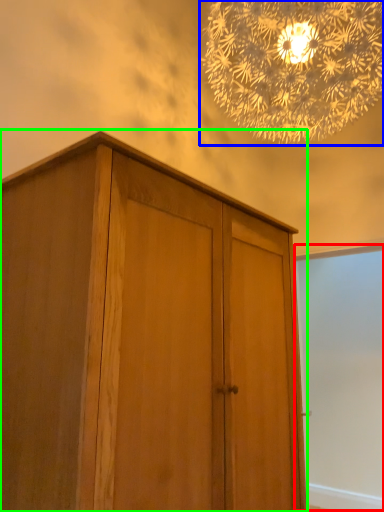
Question: Which object is the closest to the screen door (highlighted by a red box)? Choose among these: lamp (highlighted by a blue box) or cupboard (highlighted by a green box).

Choices:
 (A) lamp
 (B) cupboard

Answer: (A)